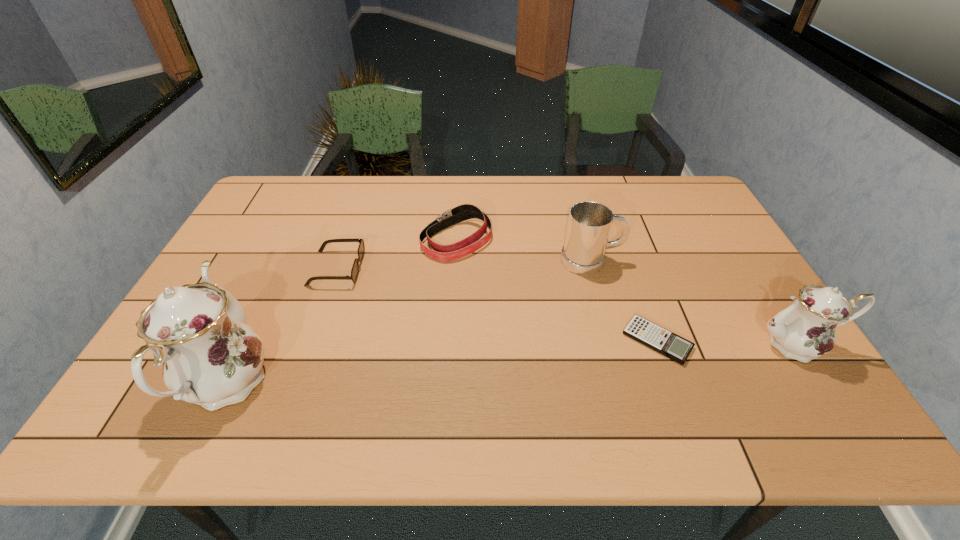
Please determine a free point for an extra chinaware to ensure balance. Please provide its 2D coordinates. Your answer should be formatted as a tuple, i.e. [(x, y)], where the tuple contains the x and y coordinates of a point satisfying the conditions above.

[(522, 363)]